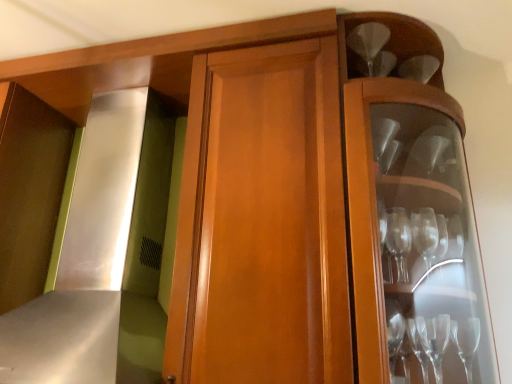
Question: In the image, is satin silver exhaust hood at left on the left side or the right side of clear glass wine glass at upper right?

Choices:
 (A) right
 (B) left

Answer: (B)

Question: From the image's perspective, is satin silver exhaust hood at left above or below clear glass wine glass at upper right?

Choices:
 (A) below
 (B) above

Answer: (A)

Question: Is satin silver exhaust hood at left bigger or smaller than clear glass wine glass at upper right?

Choices:
 (A) small
 (B) big

Answer: (B)

Question: From a real-world perspective, relative to satin silver exhaust hood at left, is clear glass wine glass at upper right vertically above or below?

Choices:
 (A) above
 (B) below

Answer: (A)

Question: Based on their sizes in the image, would you say clear glass wine glass at upper right is bigger or smaller than satin silver exhaust hood at left?

Choices:
 (A) small
 (B) big

Answer: (A)

Question: Would you say clear glass wine glass at upper right is to the left or to the right of satin silver exhaust hood at left in the picture?

Choices:
 (A) left
 (B) right

Answer: (B)

Question: Considering the positions of point (369, 23) and point (82, 145), is point (369, 23) closer or farther from the camera than point (82, 145)?

Choices:
 (A) farther
 (B) closer

Answer: (B)